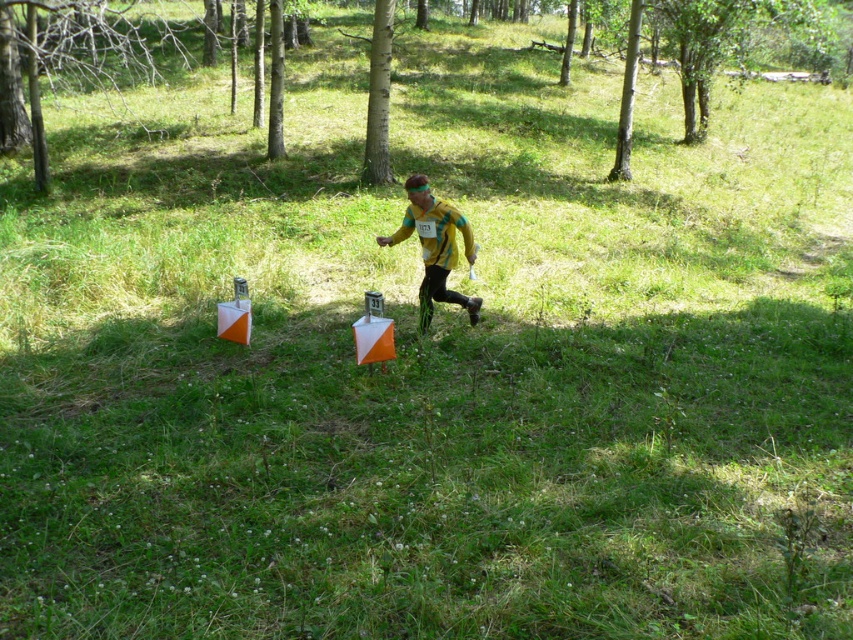
You are participating in an orienteering event and need to navigate between two markers labeled with coordinates. You are currently at the point labeled point (64, 24) and want to reach the point labeled point (376, 141). According to the scene description, which direction should you move to get closer to your destination?

You should move forward because point (64, 24) is behind point (376, 141), meaning the destination is in front of your current position.

You are planning to set up a tent in the grassy area. You want to ensure that the tent is placed where it will receive the most sunlight throughout the day. Considering the positions of the smooth bark tree at center and the smooth bark tree at upper right, which tree would cast a shadow that affects the tent placement the least?

The smooth bark tree at center has a lesser height compared to the smooth bark tree at upper right. Since shorter trees cast shorter shadows, the smooth bark tree at center would cast a smaller shadow, making its area more suitable for placing the tent to receive maximum sunlight.